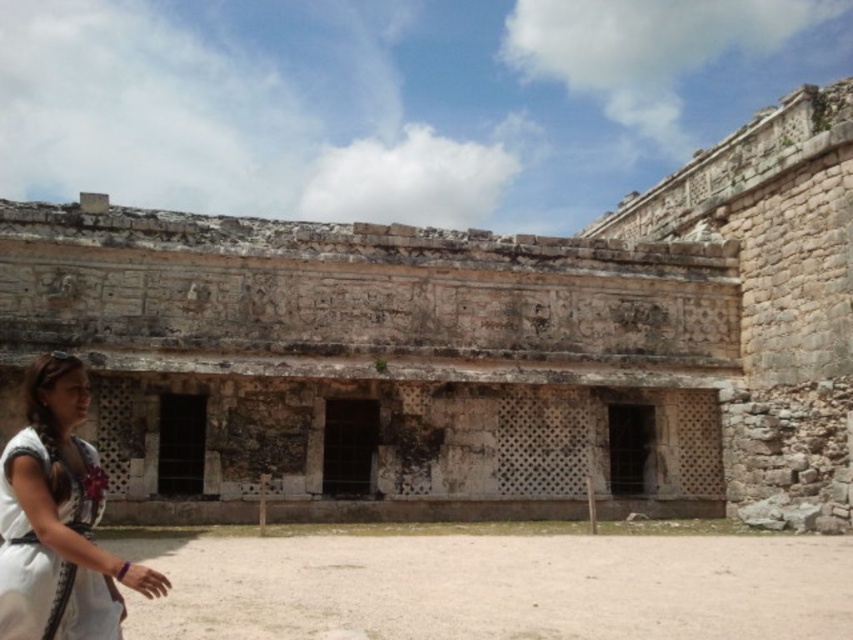
You are standing in front of the weathered stone ruins at center and the white fabric dress at lower left. Which object is closer to you?

The white fabric dress at lower left is closer to you because the weathered stone ruins at center are further away.

You are standing at the center of the image and want to take a photo of the weathered stone ruins at center. In which direction should you point your camera?

The weathered stone ruins at center are already at the center of the image, so you should point your camera directly forward to capture them.

You are a photographer planning to take a photo of the weathered stone ruins at center and the white fabric dress at lower left. Which object should you focus on first if you want to capture both in a single frame, considering their sizes?

You should focus on the weathered stone ruins at center first because it is larger than the white fabric dress at lower left, making it the primary subject for composition.